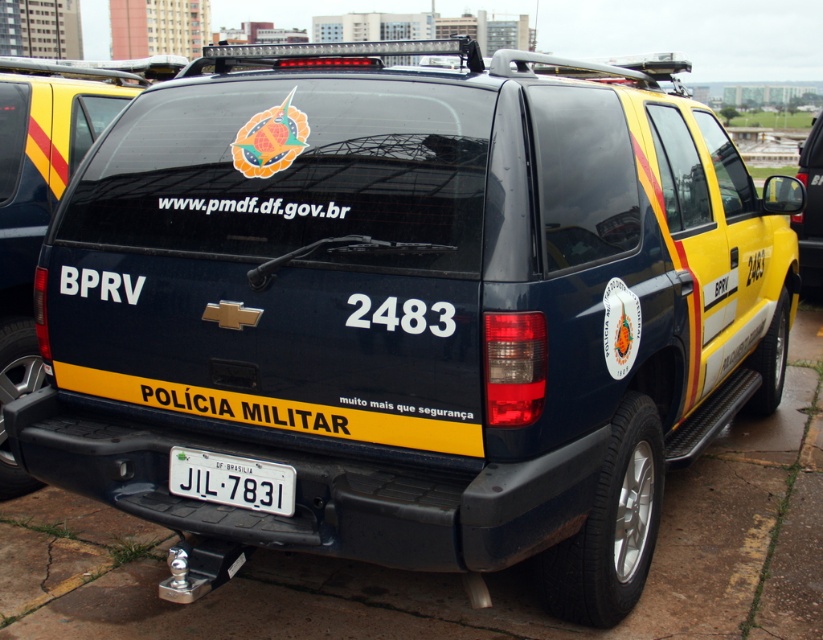
Can you confirm if matte black suv at center is wider than yellow matte suv at right?

No, matte black suv at center is not wider than yellow matte suv at right.

Is point (31, 253) behind point (816, 225)?

No.

The width and height of the screenshot is (823, 640). In order to click on matte black suv at center in this screenshot , I will do `click(44, 193)`.

The image size is (823, 640). Identify the location of matte black suv at center. coord(44,193).

Which is in front, point (54, 157) or point (207, 490)?

Point (207, 490) is more forward.

Is point (123, 100) positioned after point (198, 474)?

Yes, point (123, 100) is behind point (198, 474).

Which is in front, point (64, 176) or point (212, 465)?

Positioned in front is point (212, 465).

At what (x,y) coordinates should I click in order to perform the action: click on matte black suv at center. Please return your answer as a coordinate pair (x, y). This screenshot has height=640, width=823. Looking at the image, I should click on (44, 193).

Does white plastic license plate at center have a larger size compared to yellow matte suv at right?

No, white plastic license plate at center is not bigger than yellow matte suv at right.

Can you confirm if white plastic license plate at center is positioned below yellow matte suv at right?

Yes.

Which is behind, point (238, 484) or point (814, 120)?

The point (814, 120) is more distant.

Where is `white plastic license plate at center`? white plastic license plate at center is located at coordinates (231, 481).